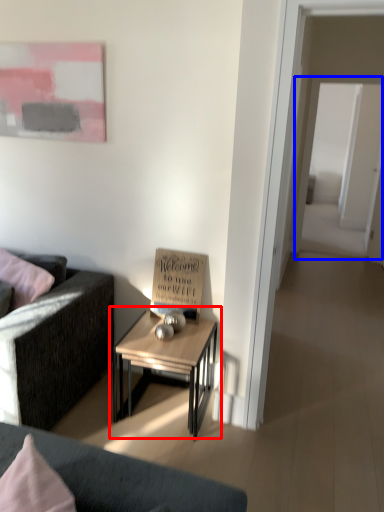
Question: Which object appears closest to the camera in this image, table (highlighted by a red box) or glass door (highlighted by a blue box)?

Choices:
 (A) table
 (B) glass door

Answer: (A)